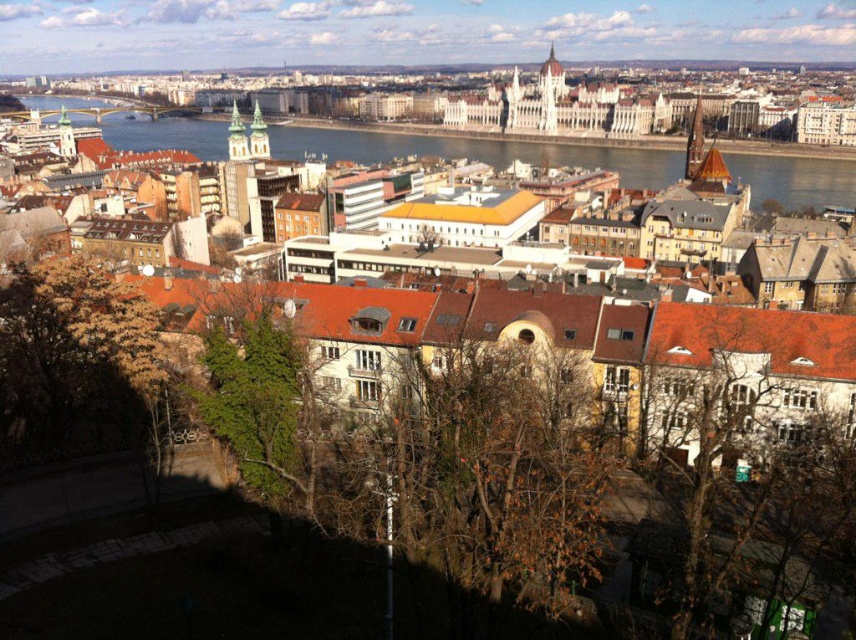
You are standing at the point labeled as point [530,100] in the cityscape image. What type of building are you facing?

The point [530,100] indicates a white stone building at upper center, so you are facing a white stone building at upper center.

You are an architect analyzing the cityscape. You observe the white stone building at upper center and the blue glass water at upper center. Which object is positioned to the right of the other?

The white stone building at upper center is to the right of blue glass water at upper center.